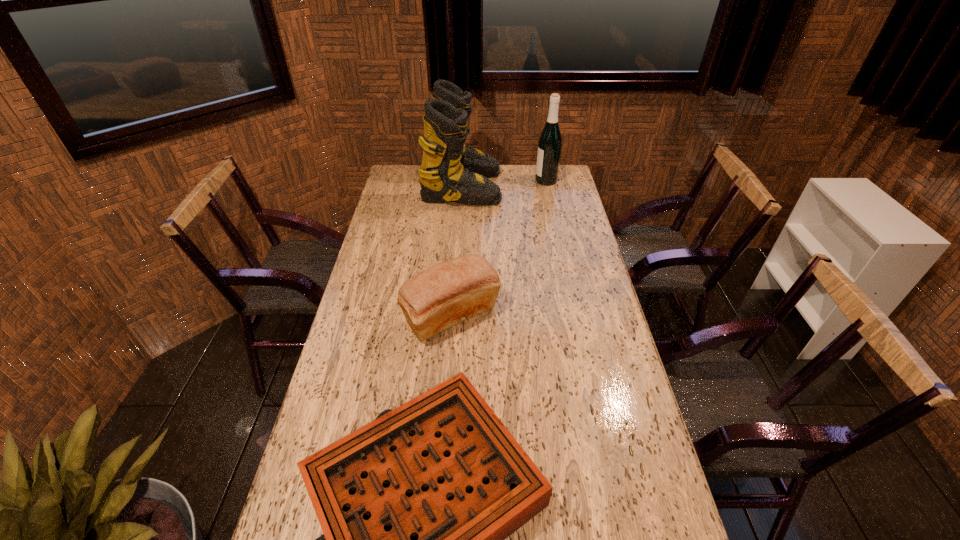
In order to click on ski boots in this screenshot , I will do `click(450, 170)`.

This screenshot has width=960, height=540. I want to click on wine bottle, so click(x=550, y=141).

At what (x,y) coordinates should I click in order to perform the action: click on the third farthest object. Please return your answer as a coordinate pair (x, y). Image resolution: width=960 pixels, height=540 pixels. Looking at the image, I should click on (444, 295).

Where is `bread`? This screenshot has height=540, width=960. bread is located at coordinates (444, 295).

Image resolution: width=960 pixels, height=540 pixels. What are the coordinates of `vacant space located on the front of the ski boots` in the screenshot? It's located at (459, 241).

What are the coordinates of `free region located 0.120m on the label of the wine bottle` in the screenshot? It's located at (510, 181).

Find the location of a particular element. vacant area situated on the label of the wine bottle is located at coordinates (473, 181).

In order to click on vacant space located on the label of the wine bottle in this screenshot , I will do `click(500, 181)`.

At what (x,y) coordinates should I click in order to perform the action: click on vacant area located on the front of the bread. Please return your answer as a coordinate pair (x, y). Looking at the image, I should click on (448, 373).

Locate an element on the screen. The width and height of the screenshot is (960, 540). ski boots at the far edge is located at coordinates (450, 170).